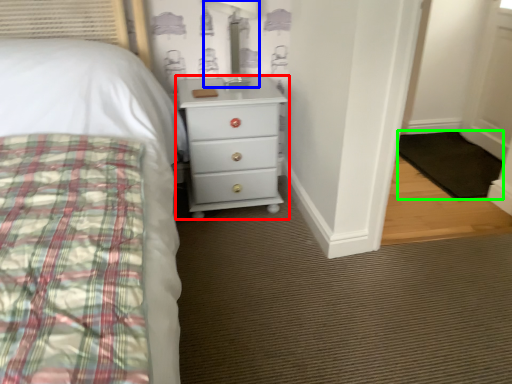
Question: Based on their relative distances, which object is farther from chest of drawers (highlighted by a red box)? Choose from table lamp (highlighted by a blue box) and mat (highlighted by a green box).

Choices:
 (A) table lamp
 (B) mat

Answer: (B)